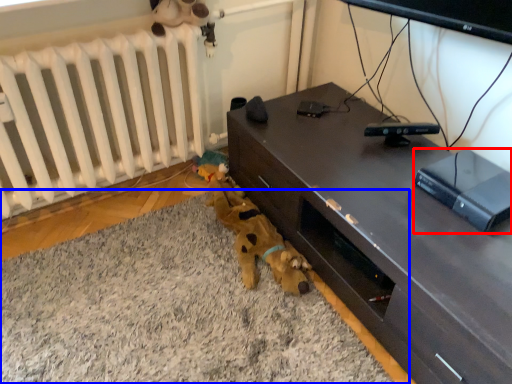
Question: Which object is further to the camera taking this photo, equipment (highlighted by a red box) or plain (highlighted by a blue box)?

Choices:
 (A) equipment
 (B) plain

Answer: (A)